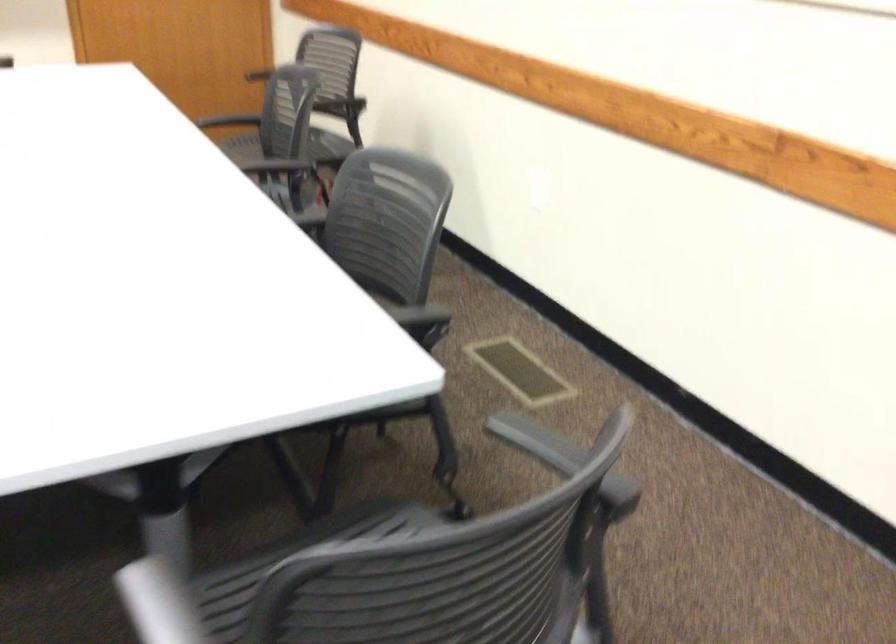
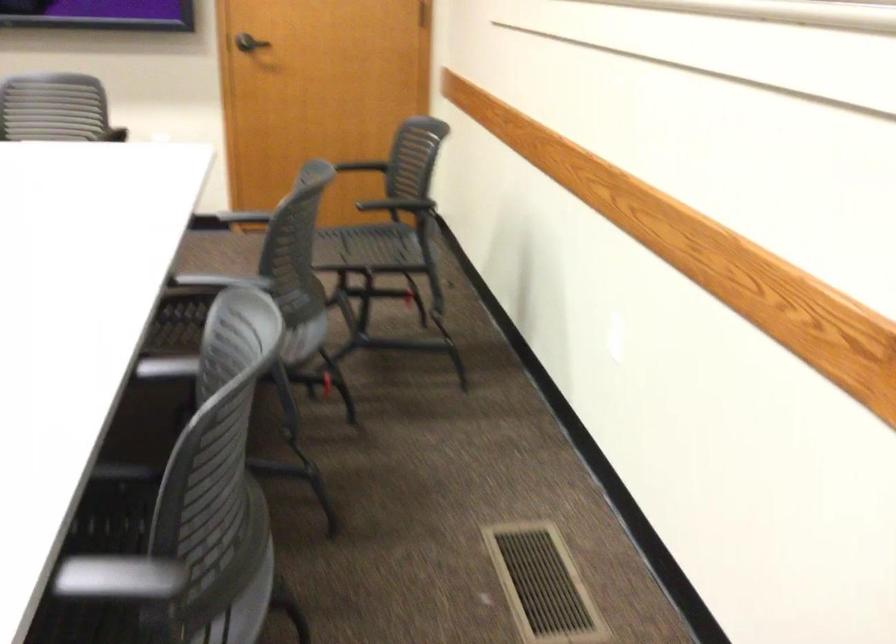
In the second image, find the point that corresponds to pixel 403 323 in the first image.

(118, 578)